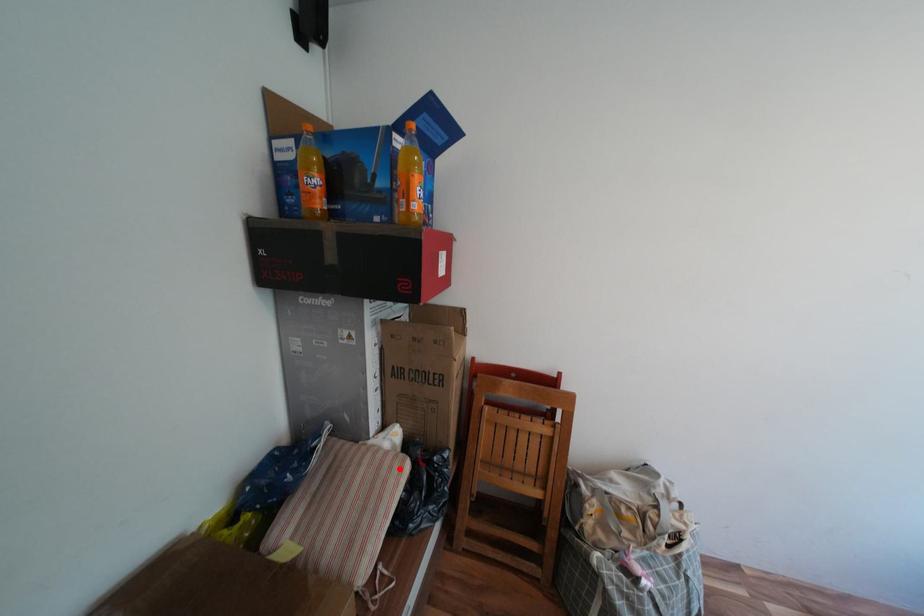
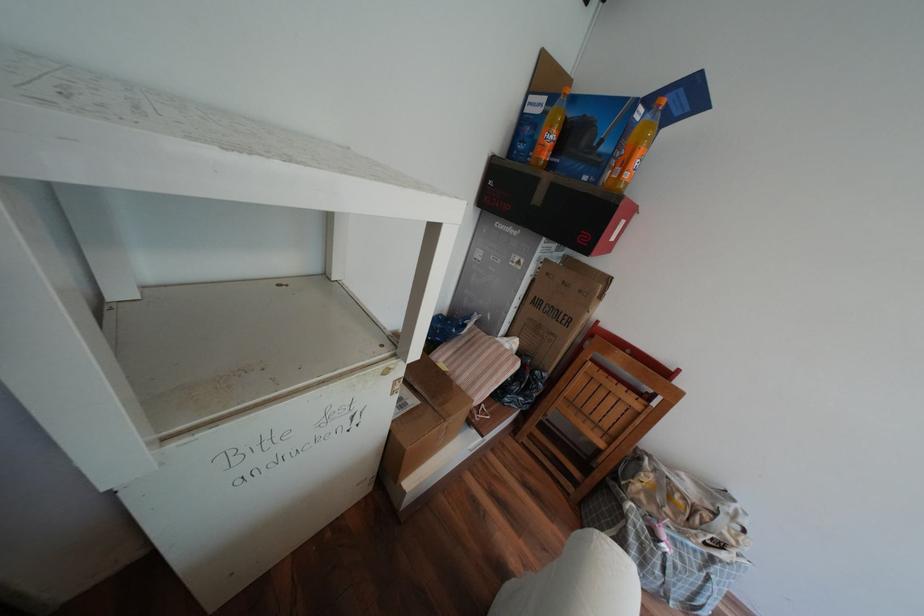
The point at the highlighted location is marked in the first image. Where is the corresponding point in the second image?

(517, 360)